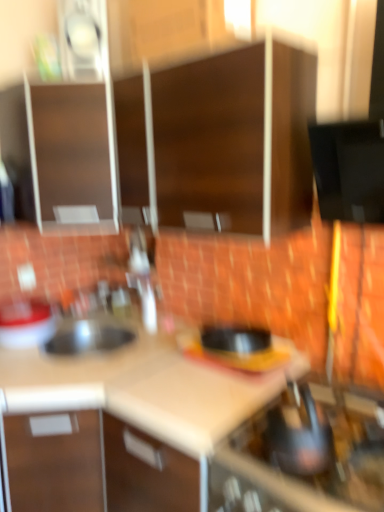
This screenshot has height=512, width=384. What are the coordinates of `vacant area in front of matte white sink at left` in the screenshot? It's located at (36, 362).